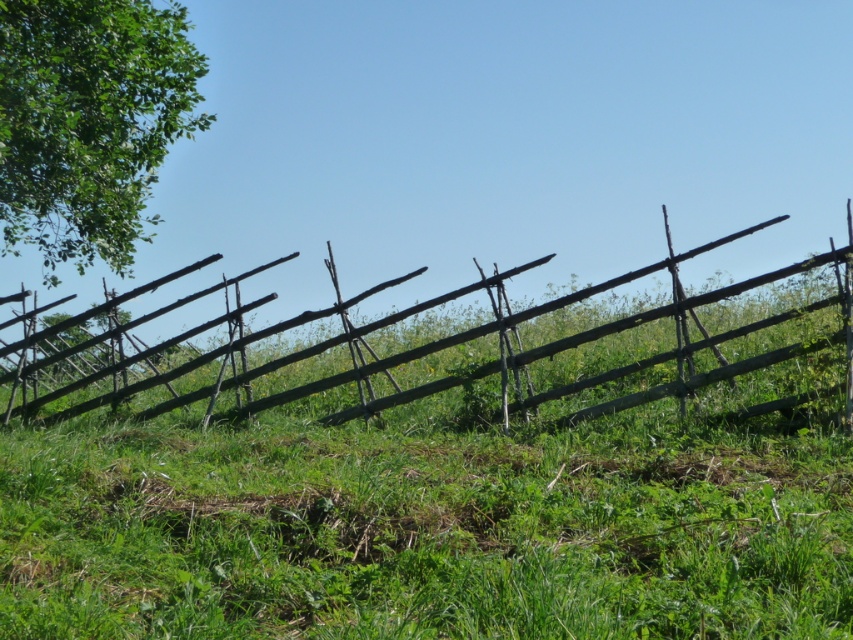
You are a bird looking for a place to perch. You can see the green leafy tree at upper left and the rustic wooden fence at center. Which one is taller and would allow you to have a better view of the surroundings?

The green leafy tree at upper left is taller than the rustic wooden fence at center, so it would allow you to have a better view of the surroundings.

You are a gardener who needs to plant a new flower bed between the green leafy tree at upper left and the rustic wooden fence at center. The flower bed requires a minimum of 3 meters of space. Based on the scene, will there be enough space to plant the flower bed?

The green leafy tree at upper left is 2.42 meters from the rustic wooden fence at center, which is less than the required 3 meters. Therefore, there is not enough space to plant the flower bed between them.